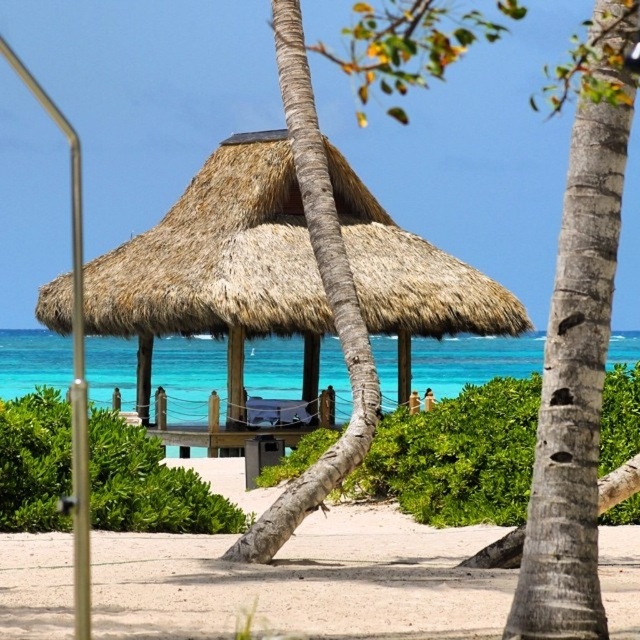
Is gray textured palm tree at right smaller than brown rough palm tree at center?

Yes, gray textured palm tree at right is smaller than brown rough palm tree at center.

Can you confirm if gray textured palm tree at right is thinner than brown rough palm tree at center?

Yes, gray textured palm tree at right is thinner than brown rough palm tree at center.

Does point (602, 342) come farther from viewer compared to point (289, 76)?

No, (602, 342) is closer to viewer.

Find the location of `gray textured palm tree at right`. gray textured palm tree at right is located at coordinates (573, 385).

Is point (298, 262) positioned behind point (566, 364)?

Yes.

Is point (186, 188) less distant than point (557, 305)?

No.

Locate an element on the screen. The height and width of the screenshot is (640, 640). thatched straw hut at center is located at coordinates (218, 257).

Where is `thatched straw hut at center`? thatched straw hut at center is located at coordinates [218, 257].

Can you confirm if thatched straw hut at center is wider than brown rough palm tree at center?

Yes.

Which of these two, thatched straw hut at center or brown rough palm tree at center, stands taller?

thatched straw hut at center is taller.

Image resolution: width=640 pixels, height=640 pixels. I want to click on thatched straw hut at center, so click(218, 257).